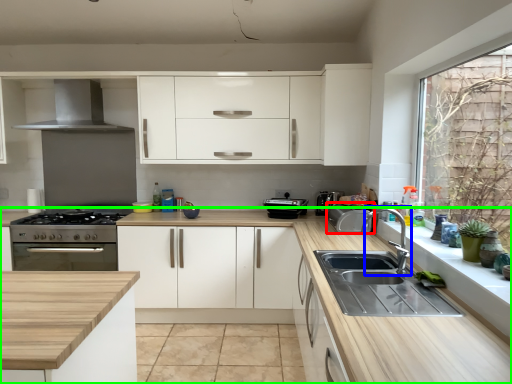
Question: Considering the real-world distances, which object is farthest from appliance (highlighted by a red box)? tap (highlighted by a blue box) or countertop (highlighted by a green box)?

Choices:
 (A) tap
 (B) countertop

Answer: (B)